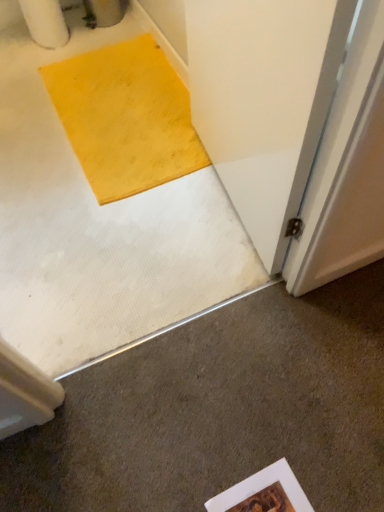
Question: Can you confirm if wooden frame at lower center is wider than white smooth concrete at lower left?

Choices:
 (A) no
 (B) yes

Answer: (A)

Question: Is wooden frame at lower center in front of white smooth concrete at lower left?

Choices:
 (A) no
 (B) yes

Answer: (A)

Question: Is white smooth concrete at lower left at the back of wooden frame at lower center?

Choices:
 (A) no
 (B) yes

Answer: (B)

Question: From the image's perspective, is wooden frame at lower center located beneath white smooth concrete at lower left?

Choices:
 (A) yes
 (B) no

Answer: (A)

Question: Is wooden frame at lower center to the right of white smooth concrete at lower left from the viewer's perspective?

Choices:
 (A) no
 (B) yes

Answer: (B)

Question: Can you see wooden frame at lower center touching white smooth concrete at lower left?

Choices:
 (A) no
 (B) yes

Answer: (A)

Question: Does white smooth concrete at lower left appear on the left side of wooden frame at lower center?

Choices:
 (A) yes
 (B) no

Answer: (A)

Question: From a real-world perspective, does white smooth concrete at lower left sit lower than wooden frame at lower center?

Choices:
 (A) no
 (B) yes

Answer: (A)

Question: Does white smooth concrete at lower left have a greater width compared to wooden frame at lower center?

Choices:
 (A) no
 (B) yes

Answer: (B)

Question: From the image's perspective, is white smooth concrete at lower left beneath wooden frame at lower center?

Choices:
 (A) no
 (B) yes

Answer: (A)

Question: Is white smooth concrete at lower left not close to wooden frame at lower center?

Choices:
 (A) yes
 (B) no

Answer: (B)

Question: Can you confirm if white smooth concrete at lower left is smaller than wooden frame at lower center?

Choices:
 (A) no
 (B) yes

Answer: (A)

Question: Considering their positions, is wooden frame at lower center located in front of or behind white smooth concrete at lower left?

Choices:
 (A) behind
 (B) front

Answer: (A)